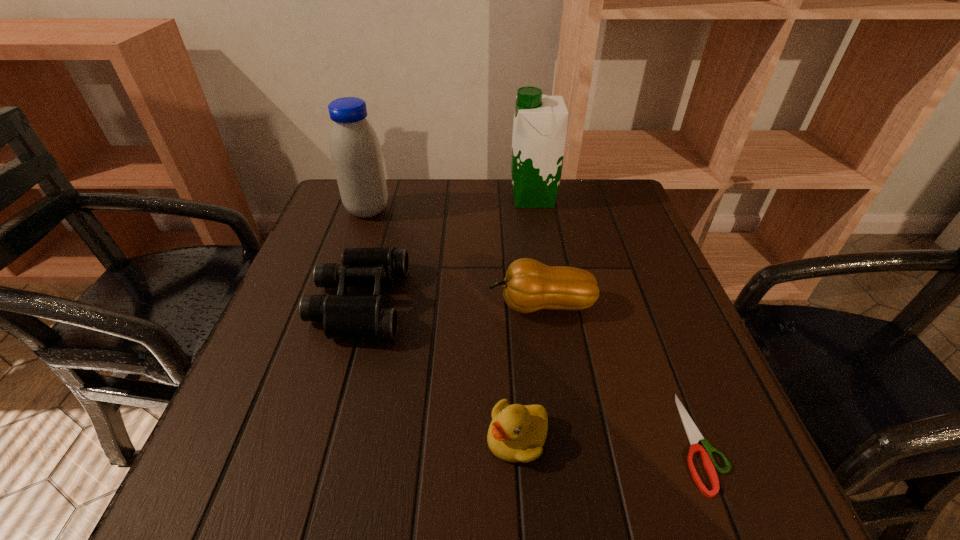
Locate an element on the screen. The width and height of the screenshot is (960, 540). vacant area at the near left corner of the desktop is located at coordinates (181, 509).

In the image, there is a desktop. At what (x,y) coordinates should I click in order to perform the action: click on vacant space at the far right corner. Please return your answer as a coordinate pair (x, y). The image size is (960, 540). Looking at the image, I should click on (591, 225).

Locate an element on the screen. This screenshot has height=540, width=960. free region at the near right corner of the desktop is located at coordinates (750, 474).

Where is `vacant area between the right soya milk and the shortest object`? vacant area between the right soya milk and the shortest object is located at coordinates (616, 320).

You are a GUI agent. You are given a task and a screenshot of the screen. Output one action in this format:
    pyautogui.click(x=<x>, y=<y>)
    Task: Click on the free space between the gourd and the fifth tallest object
    This screenshot has height=540, width=960.
    Given the screenshot: What is the action you would take?
    pyautogui.click(x=530, y=372)

Identify the location of free space between the binoculars and the gourd. This screenshot has width=960, height=540. (450, 304).

At what (x,y) coordinates should I click in order to perform the action: click on vacant space in between the right soya milk and the second shortest object. Please return your answer as a coordinate pair (x, y). Looking at the image, I should click on (525, 318).

The image size is (960, 540). What are the coordinates of `free space between the scissors and the left soya milk` in the screenshot? It's located at (534, 326).

This screenshot has width=960, height=540. Identify the location of free space between the rightmost object and the fourth shortest object. (620, 373).

Identify the location of vacant region between the right soya milk and the left soya milk. (450, 204).